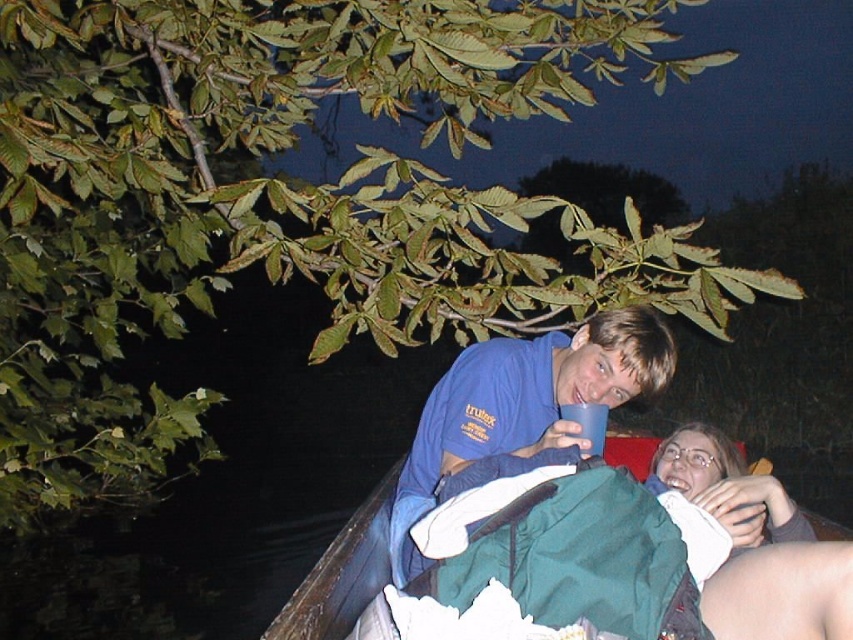
Can you confirm if blue cotton shirt at upper center is bigger than green fabric jacket at lower right?

Yes, blue cotton shirt at upper center is bigger than green fabric jacket at lower right.

Between blue cotton shirt at upper center and green fabric jacket at lower right, which one is positioned lower?

green fabric jacket at lower right is below.

Is point (430, 442) positioned in front of point (810, 577)?

That is False.

The height and width of the screenshot is (640, 853). I want to click on blue cotton shirt at upper center, so click(x=521, y=404).

Is point (688, 436) in front of point (590, 428)?

That is False.

Can you confirm if green fabric jacket at lower right is positioned to the left of blue plastic cup at upper center?

In fact, green fabric jacket at lower right is to the right of blue plastic cup at upper center.

Is point (708, 624) in front of point (558, 412)?

That is True.

Where is `green fabric jacket at lower right`? The width and height of the screenshot is (853, 640). green fabric jacket at lower right is located at coordinates (758, 547).

Between point (622, 317) and point (579, 433), which one is positioned in front?

Point (579, 433) is more forward.

Is point (422, 417) closer to viewer compared to point (602, 429)?

No, (422, 417) is further to viewer.

Is point (631, 353) positioned behind point (602, 451)?

No, it is not.

Locate an element on the screen. blue cotton shirt at upper center is located at coordinates (521, 404).